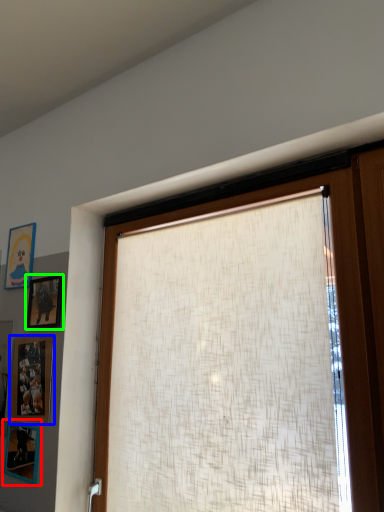
Question: Based on their relative distances, which object is nearer to picture frame (highlighted by a red box)? Choose from picture frame (highlighted by a blue box) and picture frame (highlighted by a green box).

Choices:
 (A) picture frame
 (B) picture frame

Answer: (A)